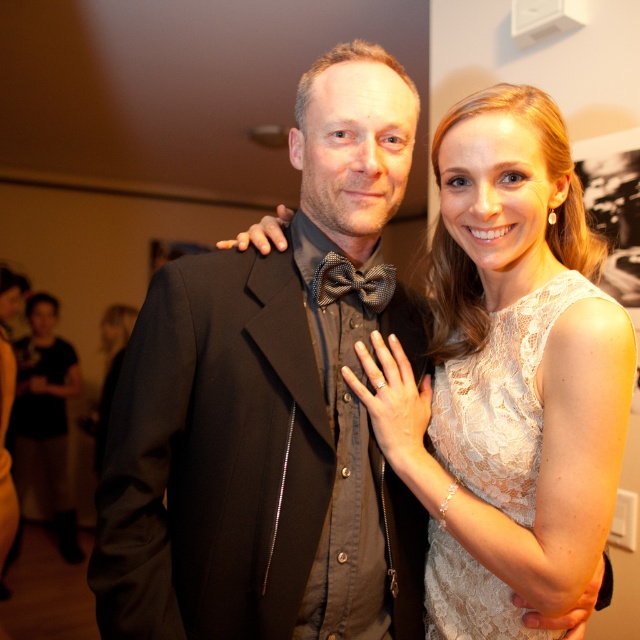
Which is above, lace fabric dress at right or plaid fabric bow tie at center?

plaid fabric bow tie at center is higher up.

What do you see at coordinates (500, 401) in the screenshot? I see `lace fabric dress at right` at bounding box center [500, 401].

You are a GUI agent. You are given a task and a screenshot of the screen. Output one action in this format:
    pyautogui.click(x=<x>, y=<y>)
    Task: Click on the lace fabric dress at right
    
    Given the screenshot: What is the action you would take?
    pyautogui.click(x=500, y=401)

Where is `lace fabric dress at right`? This screenshot has width=640, height=640. lace fabric dress at right is located at coordinates (500, 401).

The height and width of the screenshot is (640, 640). Describe the element at coordinates (540, 456) in the screenshot. I see `white lace dress at center` at that location.

Which is above, white lace dress at center or plaid fabric bow tie at center?

plaid fabric bow tie at center is higher up.

Who is more distant from viewer, (444, 150) or (360, 289)?

The point (360, 289) is more distant.

At what (x,y) coordinates should I click in order to perform the action: click on white lace dress at center. Please return your answer as a coordinate pair (x, y). This screenshot has width=640, height=640. Looking at the image, I should click on (540, 456).

Does white lace dress at center have a lesser width compared to lace fabric dress at right?

Incorrect, white lace dress at center's width is not less than lace fabric dress at right's.

Does white lace dress at center appear under lace fabric dress at right?

No, white lace dress at center is not below lace fabric dress at right.

Locate an element on the screen. The width and height of the screenshot is (640, 640). white lace dress at center is located at coordinates (540, 456).

Where is `white lace dress at center`? Image resolution: width=640 pixels, height=640 pixels. white lace dress at center is located at coordinates (540, 456).